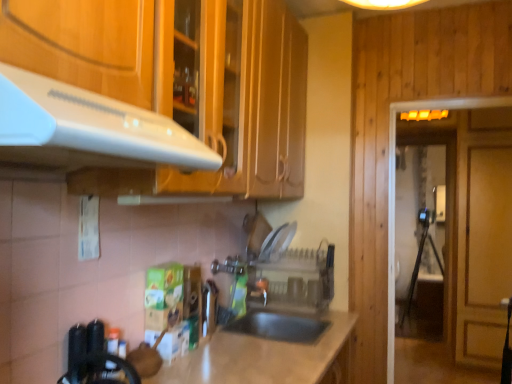
Question: Is the position of transparent glass door at right, which ranks as the 1th glass door in right-to-left order, more distant than that of clear plastic dish rack at center?

Choices:
 (A) no
 (B) yes

Answer: (B)

Question: Is transparent glass door at right, the first glass door in the back-to-front sequence, oriented towards clear plastic dish rack at center?

Choices:
 (A) yes
 (B) no

Answer: (B)

Question: Does transparent glass door at right, the second glass door positioned from the left, have a smaller size compared to clear plastic dish rack at center?

Choices:
 (A) yes
 (B) no

Answer: (B)

Question: Is transparent glass door at right, the first glass door in the back-to-front sequence, wider than clear plastic dish rack at center?

Choices:
 (A) no
 (B) yes

Answer: (A)

Question: Is transparent glass door at right, the second glass door positioned from the left, to the right of clear plastic dish rack at center from the viewer's perspective?

Choices:
 (A) yes
 (B) no

Answer: (A)

Question: In the image, is metallic silver faucet at center on the left side or the right side of transparent glass door at right, the second glass door in the back-to-front sequence?

Choices:
 (A) left
 (B) right

Answer: (A)

Question: Is metallic silver faucet at center wider or thinner than transparent glass door at right, which is the second glass door from right to left?

Choices:
 (A) thin
 (B) wide

Answer: (A)

Question: Is metallic silver faucet at center taller or shorter than transparent glass door at right, the first glass door from the left?

Choices:
 (A) short
 (B) tall

Answer: (A)

Question: In the image, is metallic silver faucet at center positioned in front of or behind transparent glass door at right, the first glass door from the front?

Choices:
 (A) front
 (B) behind

Answer: (B)

Question: From a real-world perspective, relative to transparent glass door at right, the first glass door in the back-to-front sequence, is metallic silver faucet at center vertically above or below?

Choices:
 (A) below
 (B) above

Answer: (A)

Question: Considering their positions, is metallic silver faucet at center located in front of or behind transparent glass door at right, the second glass door positioned from the left?

Choices:
 (A) front
 (B) behind

Answer: (A)

Question: Is metallic silver faucet at center bigger or smaller than transparent glass door at right, the first glass door in the back-to-front sequence?

Choices:
 (A) big
 (B) small

Answer: (B)

Question: From the image's perspective, relative to transparent glass door at right, the second glass door positioned from the left, is metallic silver faucet at center above or below?

Choices:
 (A) below
 (B) above

Answer: (A)

Question: Does point (391, 162) appear closer or farther from the camera than point (401, 142)?

Choices:
 (A) closer
 (B) farther

Answer: (A)

Question: Considering the positions of transparent glass door at right, the first glass door from the left, and transparent glass door at right, which ranks as the 1th glass door in right-to-left order, in the image, is transparent glass door at right, the first glass door from the left, taller or shorter than transparent glass door at right, which ranks as the 1th glass door in right-to-left order,?

Choices:
 (A) tall
 (B) short

Answer: (B)